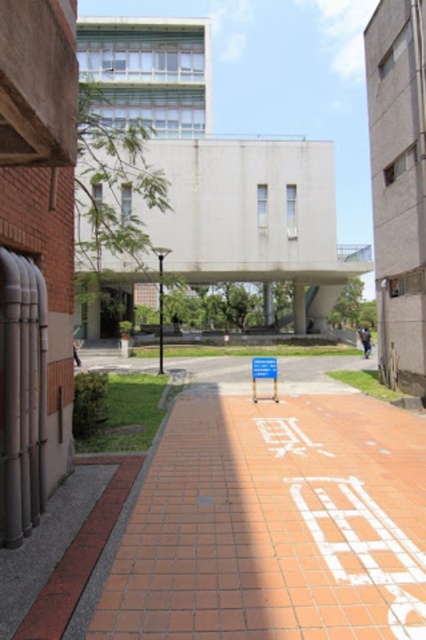
Can you confirm if white painted brick at center is shorter than blue plastic sign at center?

Yes.

Locate an element on the screen. Image resolution: width=426 pixels, height=640 pixels. white painted brick at center is located at coordinates (363, 547).